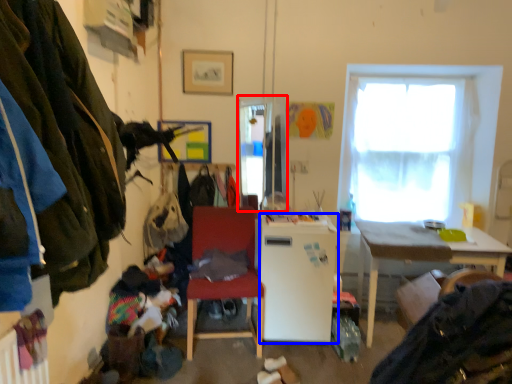
Question: Which object appears closest to the camera in this image, window screen (highlighted by a red box) or refrigerator (highlighted by a blue box)?

Choices:
 (A) window screen
 (B) refrigerator

Answer: (B)